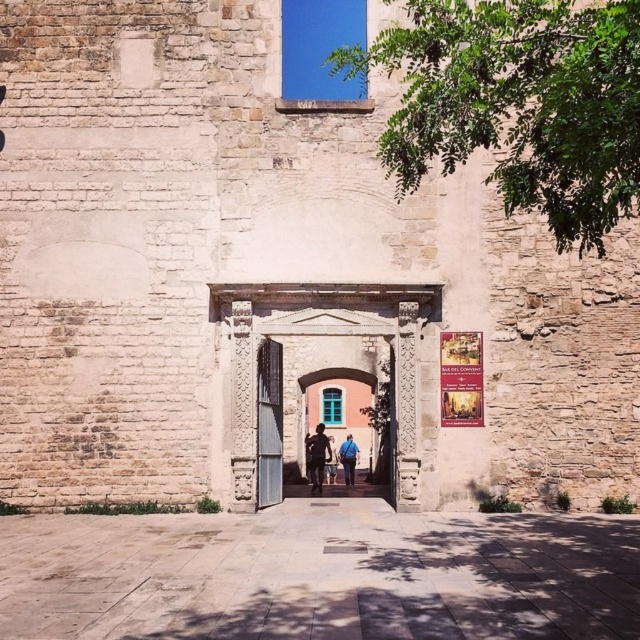
Question: Which point is closer to the camera?

Choices:
 (A) dark blue jeans at center
 (B) blue fabric jacket at center
 (C) metallic silver door at center

Answer: (C)

Question: Which object is farther from the camera taking this photo?

Choices:
 (A) metallic silver door at center
 (B) blue fabric backpack at center
 (C) blue fabric jacket at center

Answer: (C)

Question: Does metallic silver door at center have a larger size compared to blue fabric jacket at center?

Choices:
 (A) no
 (B) yes

Answer: (B)

Question: Which point is closer to the camera taking this photo?

Choices:
 (A) (321, 426)
 (B) (260, 426)

Answer: (B)

Question: Is smooth stone archway at center smaller than dark blue jeans at center?

Choices:
 (A) no
 (B) yes

Answer: (A)

Question: Can you confirm if metallic silver door at center is smaller than dark blue jeans at center?

Choices:
 (A) yes
 (B) no

Answer: (A)